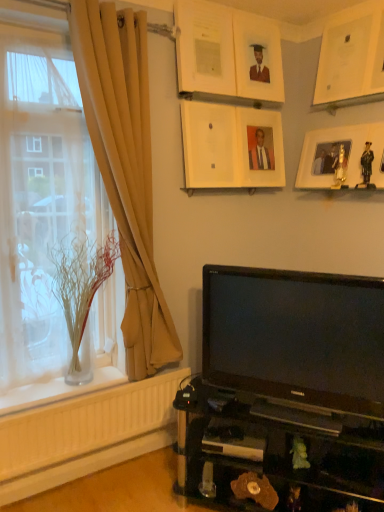
Question: From a real-world perspective, does beige fabric curtain at left sit lower than clear glass vase at left?

Choices:
 (A) yes
 (B) no

Answer: (B)

Question: From the image's perspective, is beige fabric curtain at left under clear glass vase at left?

Choices:
 (A) no
 (B) yes

Answer: (A)

Question: Considering the relative sizes of beige fabric curtain at left and clear glass vase at left in the image provided, is beige fabric curtain at left shorter than clear glass vase at left?

Choices:
 (A) no
 (B) yes

Answer: (A)

Question: Can you confirm if beige fabric curtain at left is thinner than clear glass vase at left?

Choices:
 (A) yes
 (B) no

Answer: (A)

Question: From the image's perspective, is beige fabric curtain at left above clear glass vase at left?

Choices:
 (A) yes
 (B) no

Answer: (A)

Question: Relative to matte white picture frame at upper center, the 1th picture frame viewed from the left, is black glossy tv at lower right in front or behind?

Choices:
 (A) behind
 (B) front

Answer: (B)

Question: Considering the positions of black glossy tv at lower right and matte white picture frame at upper center, the 1th picture frame viewed from the left, in the image, is black glossy tv at lower right wider or thinner than matte white picture frame at upper center, the 1th picture frame viewed from the left,?

Choices:
 (A) thin
 (B) wide

Answer: (B)

Question: Choose the correct answer: Is black glossy tv at lower right inside matte white picture frame at upper center, the 1th picture frame viewed from the left, or outside it?

Choices:
 (A) outside
 (B) inside

Answer: (A)

Question: From a real-world perspective, is black glossy tv at lower right positioned above or below matte white picture frame at upper center, the 1th picture frame viewed from the left?

Choices:
 (A) above
 (B) below

Answer: (B)

Question: Relative to wooden photo frame at upper right, acting as the second picture frame starting from the right, is beige fabric curtain at left in front or behind?

Choices:
 (A) behind
 (B) front

Answer: (B)

Question: From the image's perspective, is beige fabric curtain at left above or below wooden photo frame at upper right, positioned as the fifth picture frame in left-to-right order?

Choices:
 (A) below
 (B) above

Answer: (A)

Question: Is point (132, 359) closer or farther from the camera than point (374, 144)?

Choices:
 (A) farther
 (B) closer

Answer: (A)

Question: In terms of width, does beige fabric curtain at left look wider or thinner when compared to wooden photo frame at upper right, acting as the second picture frame starting from the right?

Choices:
 (A) thin
 (B) wide

Answer: (B)

Question: Is clear glass vase at left to the left or to the right of clear glass vase at left in the image?

Choices:
 (A) right
 (B) left

Answer: (A)

Question: From a real-world perspective, is clear glass vase at left above or below clear glass vase at left?

Choices:
 (A) below
 (B) above

Answer: (A)